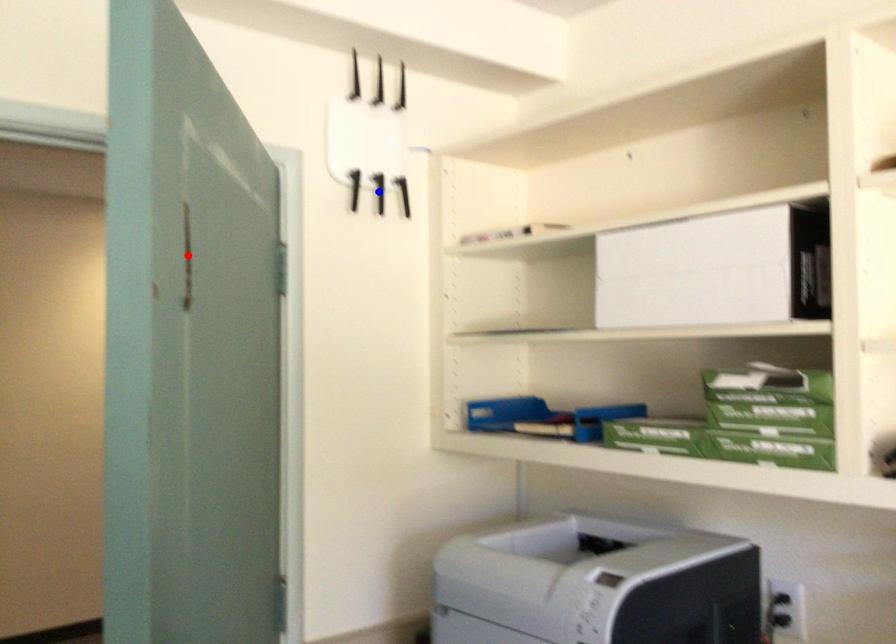
Question: In the image, two points are highlighted. Which point is nearer to the camera? Reply with the corresponding letter.

Choices:
 (A) blue point
 (B) red point

Answer: (B)